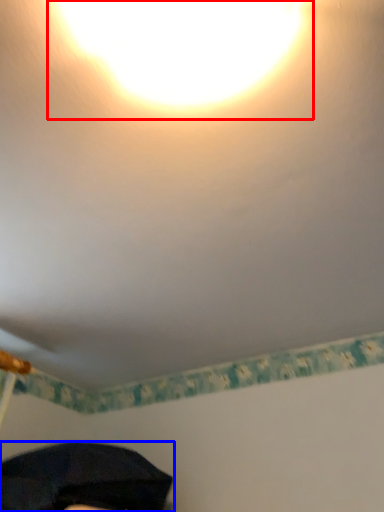
Question: Which point is closer to the camera, light (highlighted by a red box) or umbrella (highlighted by a blue box)?

Choices:
 (A) light
 (B) umbrella

Answer: (A)